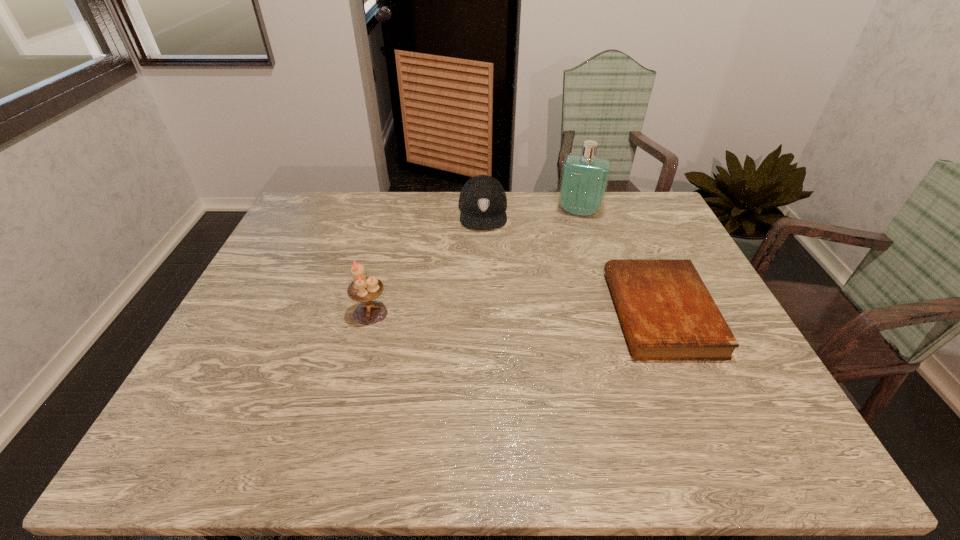
This screenshot has height=540, width=960. In the image, there is a desktop. What are the coordinates of `free region at the near edge` in the screenshot? It's located at (528, 403).

Find the location of a particular element. This screenshot has width=960, height=540. free space at the left edge of the desktop is located at coordinates (276, 261).

At what (x,y) coordinates should I click in order to perform the action: click on vacant space at the far left corner. Please return your answer as a coordinate pair (x, y). The image size is (960, 540). Looking at the image, I should click on (322, 194).

Locate an element on the screen. This screenshot has height=540, width=960. blank space at the far right corner of the desktop is located at coordinates (644, 200).

Find the location of a particular element. free region at the near right corner of the desktop is located at coordinates (721, 400).

Find the location of `free space between the shortest object and the third object from right to left`. free space between the shortest object and the third object from right to left is located at coordinates (x=572, y=262).

Locate an element on the screen. The height and width of the screenshot is (540, 960). free space between the leftmost object and the third object from right to left is located at coordinates click(427, 262).

This screenshot has height=540, width=960. In order to click on free area in between the shortest object and the cap in this screenshot , I will do `click(572, 262)`.

Where is `empty location between the leftmost object and the tallest object`? The height and width of the screenshot is (540, 960). empty location between the leftmost object and the tallest object is located at coordinates (475, 262).

This screenshot has width=960, height=540. I want to click on free space between the third object from right to left and the perfume, so click(x=531, y=212).